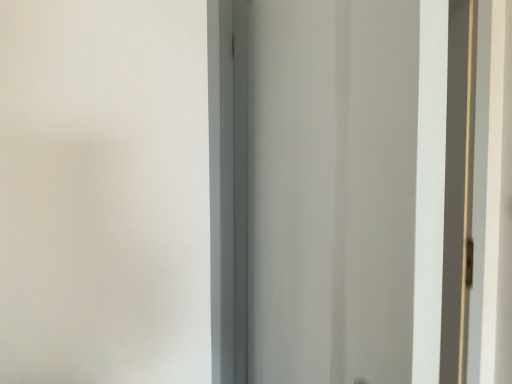
Describe the element at coordinates (352, 190) in the screenshot. I see `transparent glass door at center` at that location.

What are the coordinates of `transparent glass door at center` in the screenshot? It's located at (352, 190).

You are a GUI agent. You are given a task and a screenshot of the screen. Output one action in this format:
    pyautogui.click(x=<x>, y=<y>)
    Task: Click on the transparent glass door at center
    This screenshot has height=384, width=512.
    Given the screenshot: What is the action you would take?
    pyautogui.click(x=352, y=190)